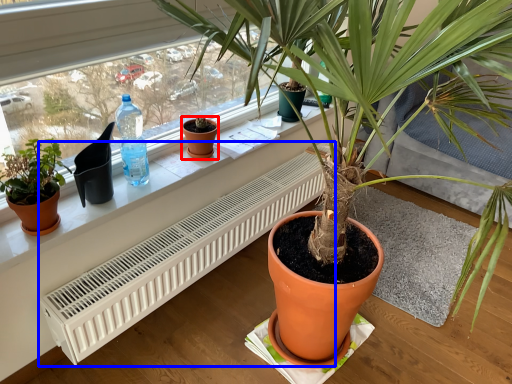
Question: Which object is closer to the camera taking this photo, flowerpot (highlighted by a red box) or air conditioner (highlighted by a blue box)?

Choices:
 (A) flowerpot
 (B) air conditioner

Answer: (B)